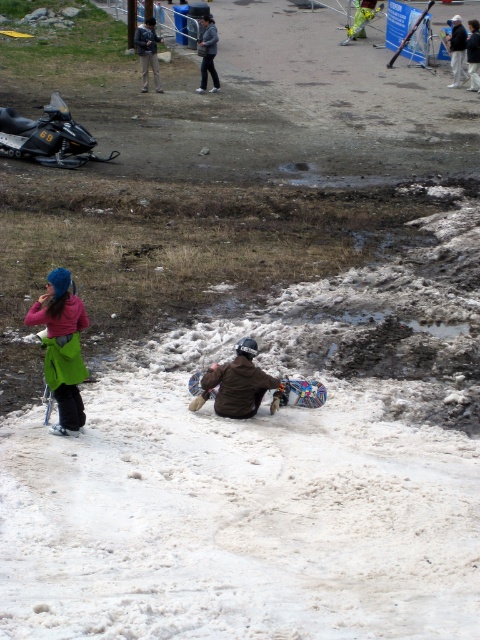
Question: Which point appears closest to the camera in this image?

Choices:
 (A) (322, 392)
 (B) (52, 276)

Answer: (B)

Question: Does dark gray jacket at upper center have a larger size compared to white cotton jacket at upper right?

Choices:
 (A) yes
 (B) no

Answer: (B)

Question: Which object is positioned closest to the white cotton jacket at upper right?

Choices:
 (A) denim jacket at upper center
 (B) dark brown leather jacket at lower center

Answer: (B)

Question: Can you confirm if black matte snowmobile at left is positioned to the left of matte blue snowboard at center?

Choices:
 (A) yes
 (B) no

Answer: (A)

Question: Which of the following is the closest to the observer?

Choices:
 (A) (152, 58)
 (B) (56, 342)
 (C) (213, 68)
 (D) (205, 372)

Answer: (B)

Question: Is black matte snowmobile at left wider than denim jacket at upper center?

Choices:
 (A) yes
 (B) no

Answer: (A)